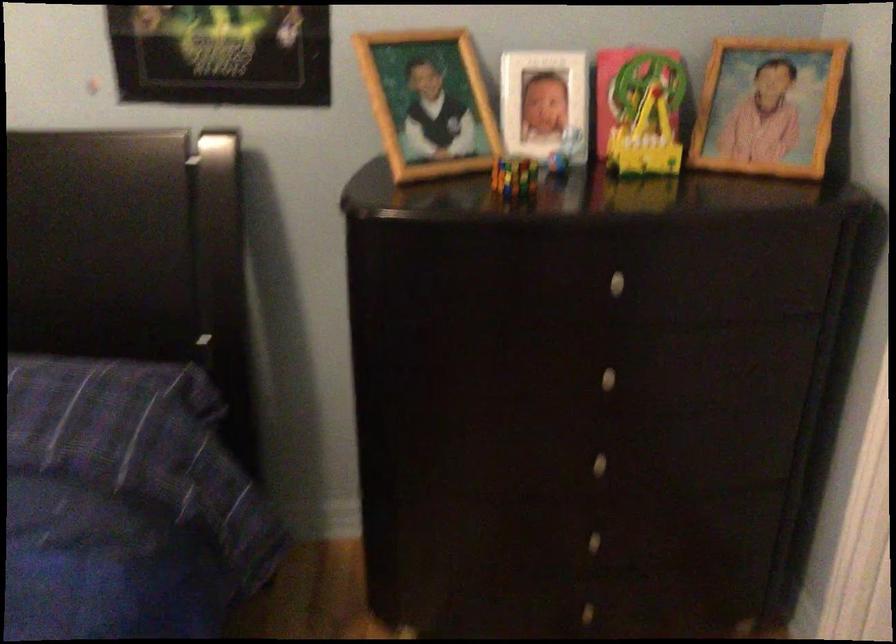
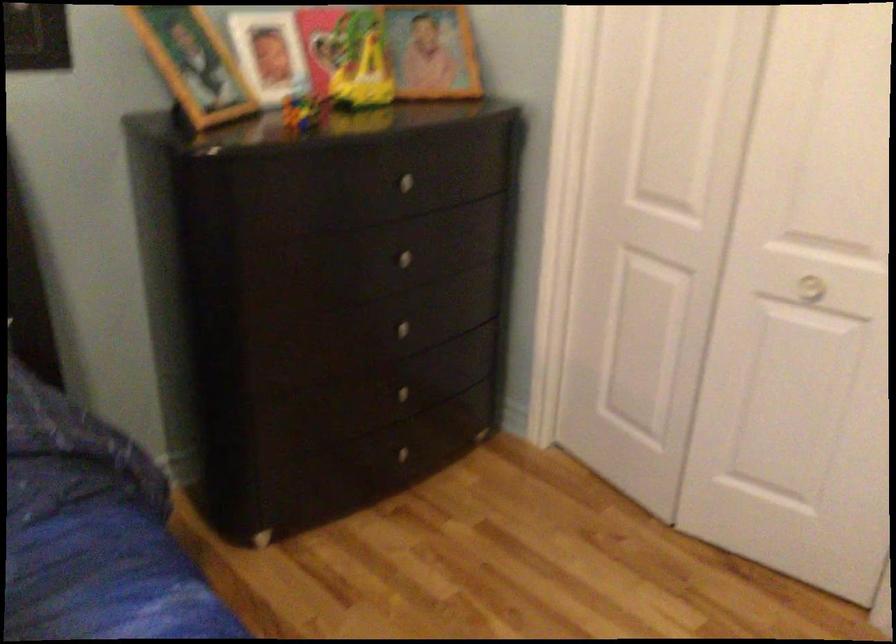
Where in the second image is the point corresponding to the point at 586,536 from the first image?

(400, 393)